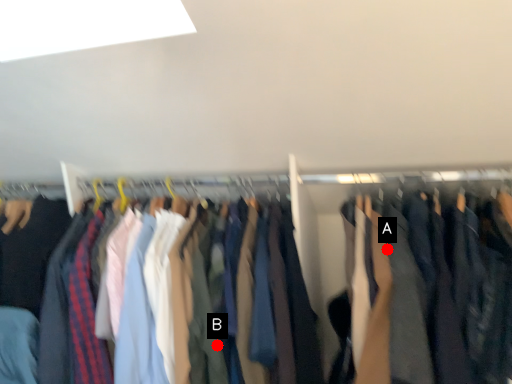
Question: Two points are circled on the image, labeled by A and B beside each circle. Among these points, which one is nearest to the camera?

Choices:
 (A) A is closer
 (B) B is closer

Answer: (A)